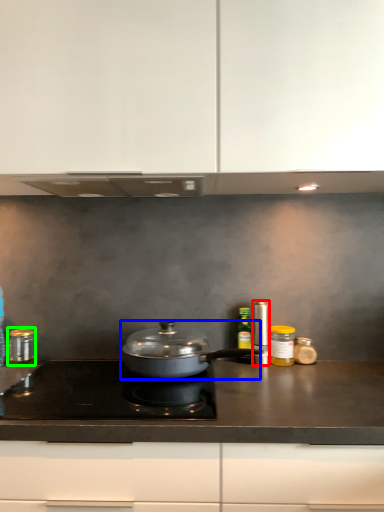
Question: Which is nearer to the kitchen appliance (highlighted by a red box)? kitchen appliance (highlighted by a blue box) or kitchen appliance (highlighted by a green box).

Choices:
 (A) kitchen appliance
 (B) kitchen appliance

Answer: (A)